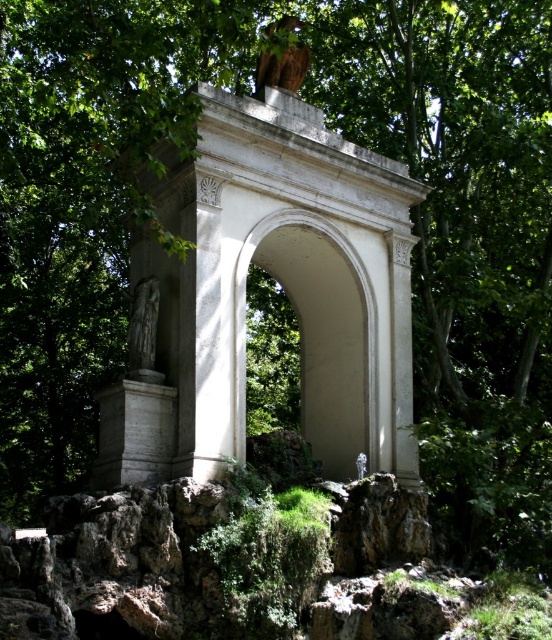
You are an architect examining the classical monument. You notice the white stone archway at center and the wooden birdhouse at upper center. Which object is taller?

The white stone archway at center is taller than the wooden birdhouse at upper center.

You are standing in front of the classical monument and want to take a photo that includes both the white stone archway at center and the gray stone statue at center. Which object should you position closer to the front of your camera frame to ensure both are in focus?

The white stone archway at center is closer to the viewer than the gray stone statue at center, so you should position the white stone archway at center closer to the front of your camera frame to ensure both are in focus.

You are standing at the base of the monument and want to take a photo of the gray stone statue at center. If your camera can focus up to 40 meters, will it be able to capture the statue clearly?

The gray stone statue at center is 39.57 meters away from the viewer, which is within the camera focus range of up to 40 meters. Therefore, the camera should be able to capture the statue clearly.